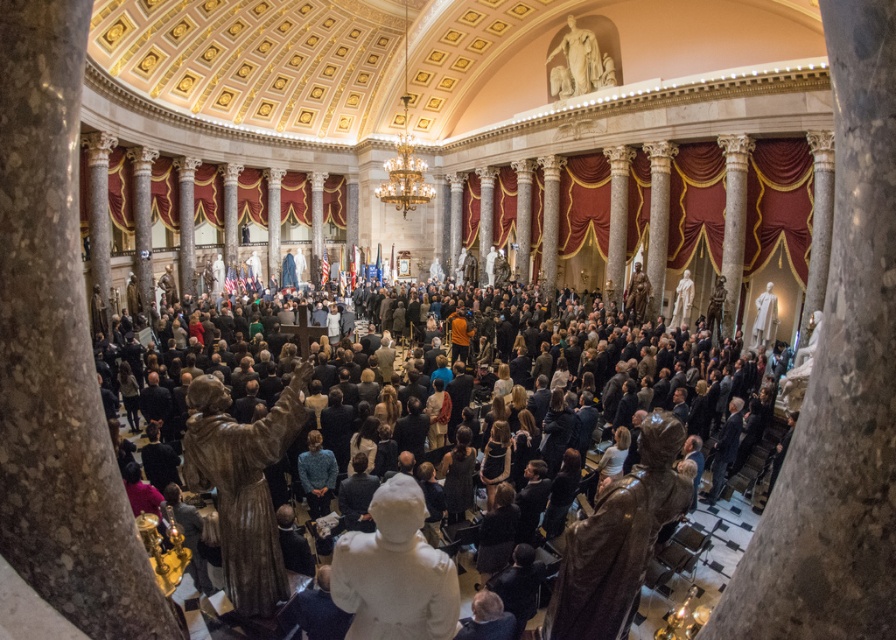
You are an art curator planning to install a new lighting system in the grand hall. The bronze statue at center and the white marble statue at upper center require specific light fixtures. The bronze statue needs a spotlight that can cover up to 1.8 meters in height, while the white marble statue requires a fixture that accommodates its height. Given their heights, can both statues be illuminated appropriately with their respective fixtures?

The bronze statue at center is taller than the white marble statue at upper center. Since the bronze statue requires a spotlight for up to 1.8 meters and it is taller, its height must be within or equal to 1.8 meters to fit the fixture. If the bronze statue exceeds 1.8 meters, the fixture won

You are an event planner arranging a ceremony in this grand hall. You need to place a podium between the black matte crowd at center and the white marble statue at center. Where should you position the podium so it is equidistant from both?

The podium should be placed exactly in the middle between the black matte crowd at center and the white marble statue at center to ensure equal distance from both.

You are an art curator planning to install a new light fixture in this grand hall. You notice the black matte crowd at center and the white marble statue at center. Which object should the light fixture be placed above to ensure it illuminates the object below it?

The light fixture should be placed above the white marble statue at center because the black matte crowd at center is already positioned above it, meaning the statue is below and would be illuminated by the light placed above.